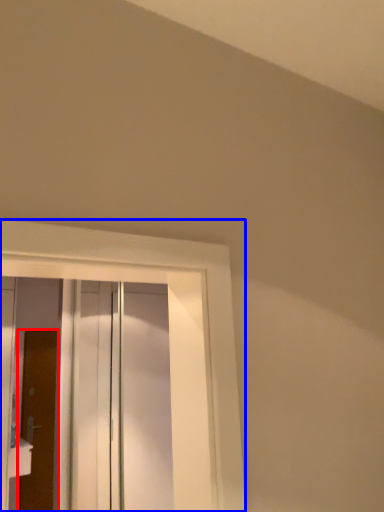
Question: Among these objects, which one is farthest to the camera, door (highlighted by a red box) or window (highlighted by a blue box)?

Choices:
 (A) door
 (B) window

Answer: (A)